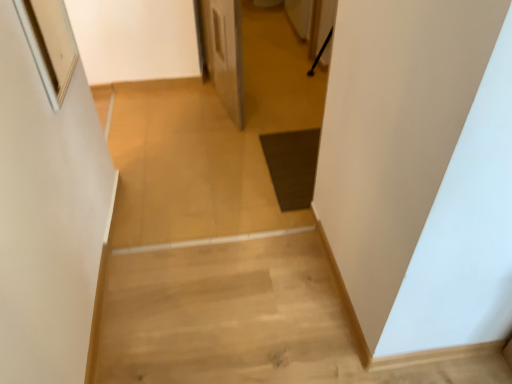
Where is `free space to the left of wooden door at center`? The width and height of the screenshot is (512, 384). free space to the left of wooden door at center is located at coordinates [x=166, y=103].